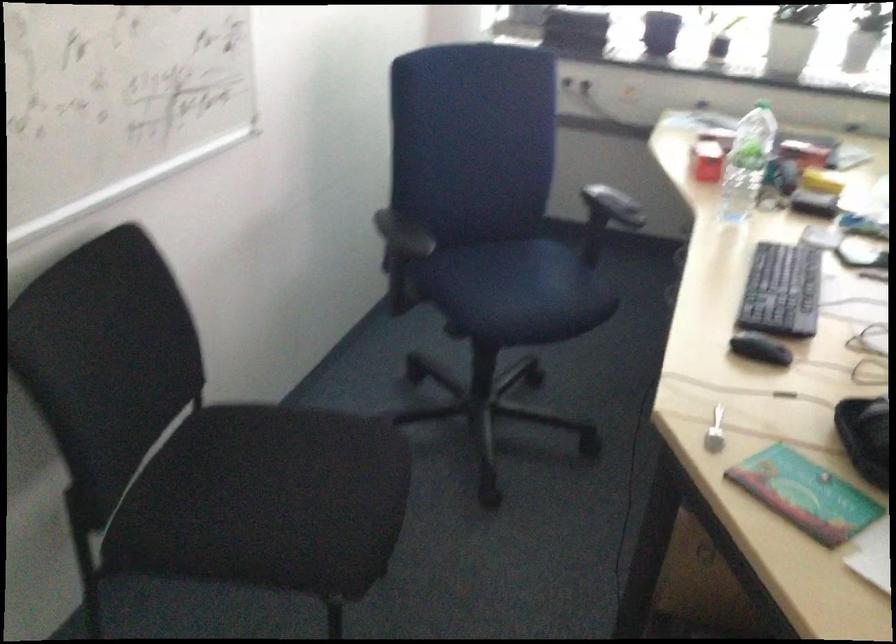
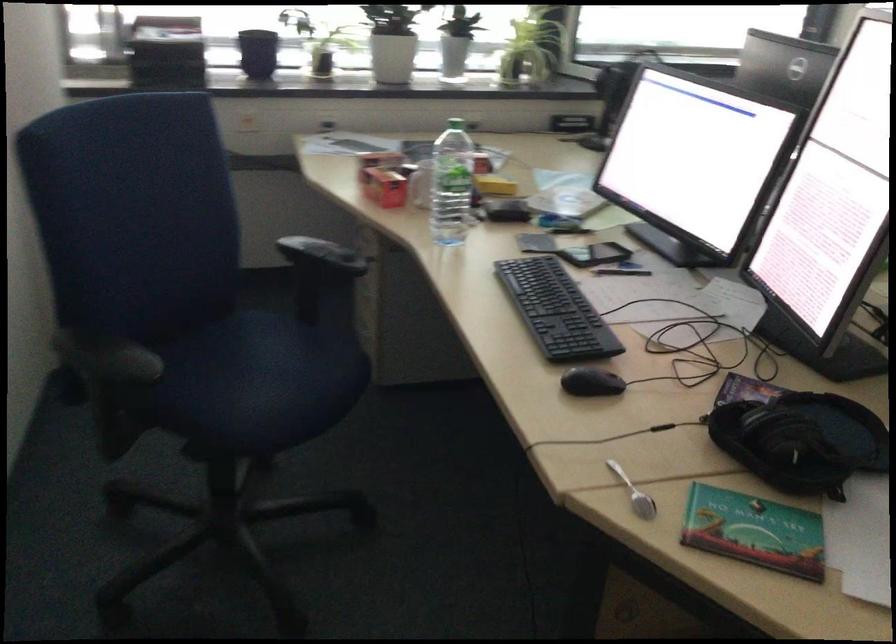
Where in the second image is the point corresponding to (x=810, y=500) from the first image?

(754, 531)